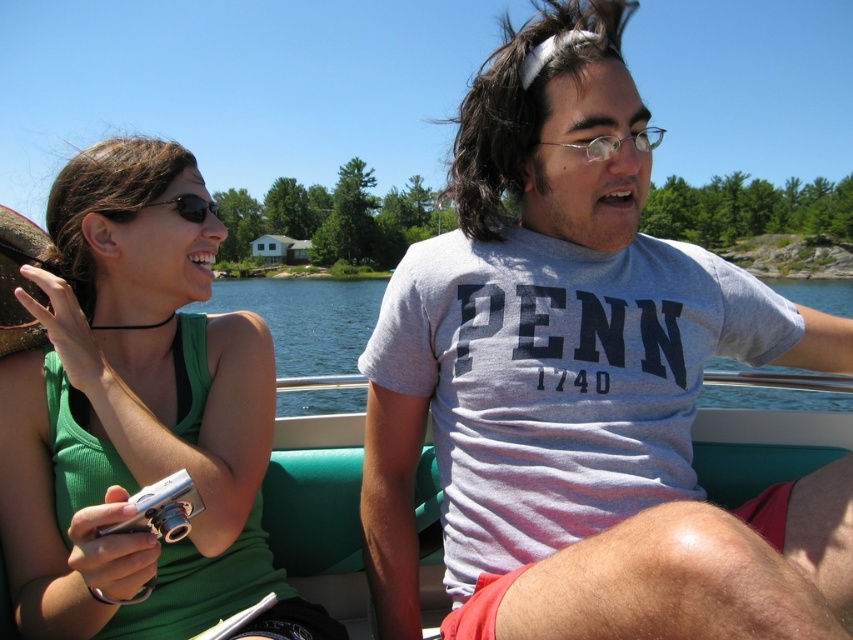
You are standing on the dock and want to take a photo of the boat with the two people. The boat is at point point (281, 588). If your camera has a focal length of 50mm, what is the minimum distance you need to be from the dock to capture the entire boat in your photo?

The point (281, 588) is 6.08 feet from the viewer. To capture the entire boat in a 50mm focal length photo, you should position yourself at least 6.08 feet away from the dock to ensure the boat fits within the frame.

You are planning to place a small cooler on the teal fabric boat at center. The cooler is as wide as the black reflective sunglasses at upper left. Will the cooler fit on the boat?

The teal fabric boat at center might be wider than black reflective sunglasses at upper left, so the cooler, which is as wide as the sunglasses, might fit on the boat.

You are a photographer trying to capture a closeup of the green matte tank top at upper left and the teal fabric boat at center. Given that your camera can only focus on one object at a time, which object should you choose to ensure it appears larger in the photo?

The green matte tank top at upper left has a smaller size compared to teal fabric boat at center, so you should choose the teal fabric boat at center to ensure it appears larger in the photo.